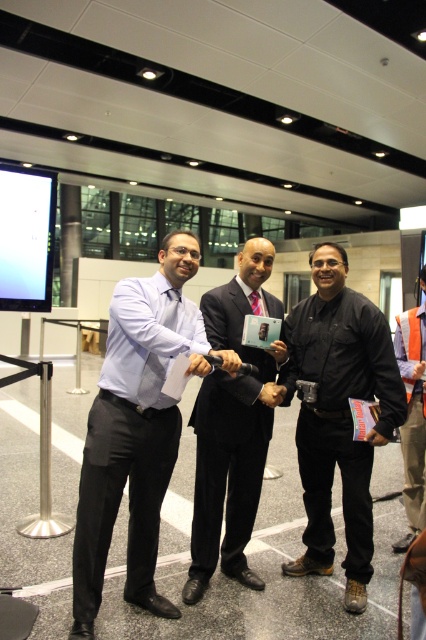
You are a photographer trying to capture a group photo of the matte blue shirt at center and the black leather jacket at center. The camera you are using has a minimum focusing distance of 28 inches. Can you take a clear photo of both subjects without moving them?

The matte blue shirt at center is 28.10 inches from black leather jacket at center. Since the camera requires a minimum focusing distance of 28 inches, the distance between them is just enough to allow the camera to focus on both subjects. Therefore, you can take a clear photo of both the matte blue shirt at center and the black leather jacket at center without moving them.

You are an event organizer who needs to arrange seating for the black leather jacket at center and the orange safety vest at right. Based on their positions in the image, which one should you seat closer to the front of the room to maintain their visual hierarchy as seen in the image?

The black leather jacket at center should be seated closer to the front of the room because it is closer to the viewer in the image, maintaining its prominence as seen in the scene.

You are standing in the same room as the three men and want to move from point A to point B. Point A is at coordinates point (129, 436) and point B is at coordinates point (247, 248). Which point is closer to you?

Point (129, 436) is closer to the viewer than point (247, 248), so point A is closer to you.